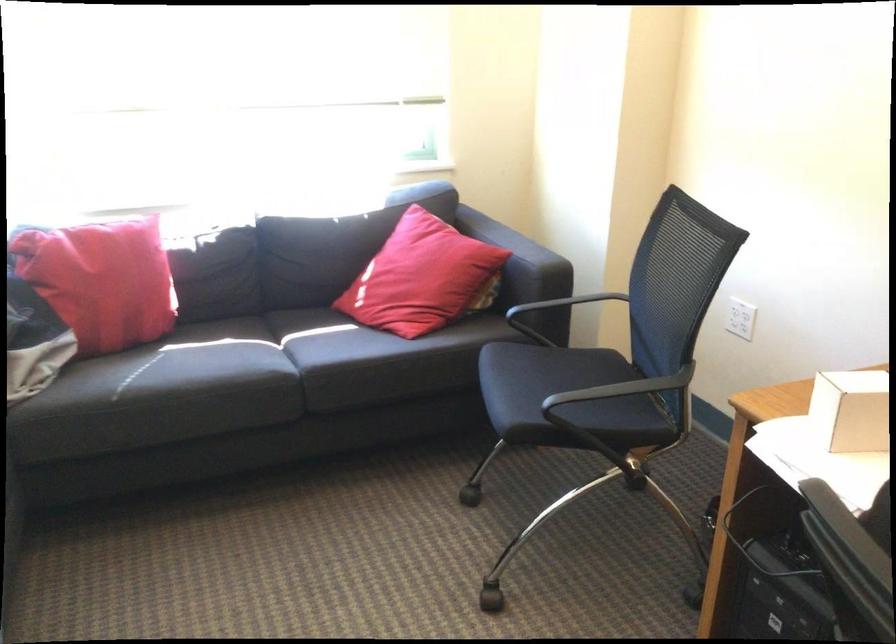
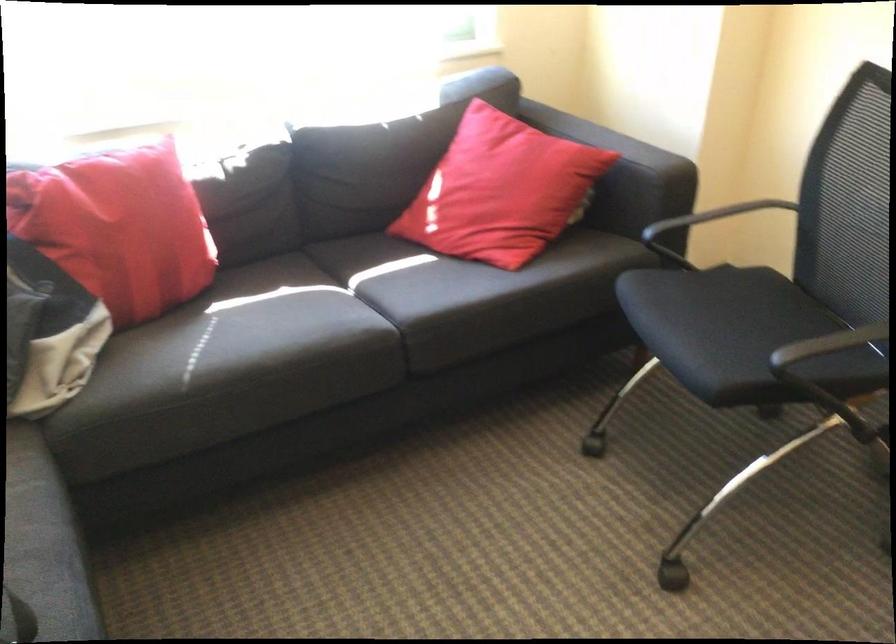
In the second image, find the point that corresponds to point (412, 272) in the first image.

(501, 190)